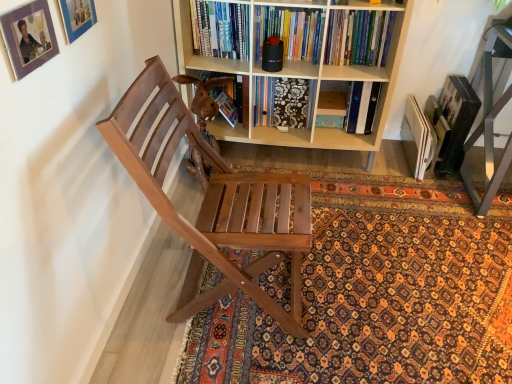
This screenshot has width=512, height=384. Describe the element at coordinates (205, 102) in the screenshot. I see `brown wooden swivel chair at center` at that location.

This screenshot has width=512, height=384. What do you see at coordinates (77, 17) in the screenshot? I see `matte blue picture frame at upper left, the 2th picture frame when ordered from front to back` at bounding box center [77, 17].

What do you see at coordinates (212, 200) in the screenshot?
I see `wooden chair at left` at bounding box center [212, 200].

Identify the location of patterned carpet at center. This screenshot has width=512, height=384. (377, 294).

Could you tell me if brown wooden swivel chair at center is turned towards matte blue picture frame at upper left, the first picture frame when ordered from back to front?

No, brown wooden swivel chair at center is not facing towards matte blue picture frame at upper left, the first picture frame when ordered from back to front.

Between brown wooden swivel chair at center and matte blue picture frame at upper left, the 2th picture frame when ordered from front to back, which one has more height?

With more height is brown wooden swivel chair at center.

How much distance is there between brown wooden swivel chair at center and matte blue picture frame at upper left, the first picture frame when ordered from back to front?

32.03 inches.

Which is in front, brown wooden swivel chair at center or matte blue picture frame at upper left, the first picture frame when ordered from back to front?

matte blue picture frame at upper left, the first picture frame when ordered from back to front.

Consider the image. From a real-world perspective, who is located higher, matte purple picture frame at upper left, marked as the first picture frame in a front-to-back arrangement, or wooden chair at left?

matte purple picture frame at upper left, marked as the first picture frame in a front-to-back arrangement, from a real-world perspective.

What's the angular difference between matte purple picture frame at upper left, marked as the first picture frame in a front-to-back arrangement, and wooden chair at left's facing directions?

They differ by 0.158 degrees in their facing directions.

Is matte purple picture frame at upper left, which is the second picture frame from back to front, wider than wooden chair at left?

No, matte purple picture frame at upper left, which is the second picture frame from back to front, is not wider than wooden chair at left.

Considering the relative sizes of matte purple picture frame at upper left, marked as the first picture frame in a front-to-back arrangement, and wooden chair at left in the image provided, is matte purple picture frame at upper left, marked as the first picture frame in a front-to-back arrangement, bigger than wooden chair at left?

No.

Choose the correct answer: Is patterned carpet at center inside matte purple picture frame at upper left, marked as the first picture frame in a front-to-back arrangement, or outside it?

patterned carpet at center is not inside matte purple picture frame at upper left, marked as the first picture frame in a front-to-back arrangement, it's outside.

Considering the positions of point (200, 370) and point (22, 61), is point (200, 370) closer or farther from the camera than point (22, 61)?

Point (200, 370) appears to be farther away from the viewer than point (22, 61).

Measure the distance between patterned carpet at center and matte purple picture frame at upper left, which is the second picture frame from back to front.

The distance of patterned carpet at center from matte purple picture frame at upper left, which is the second picture frame from back to front, is 4.56 feet.

From a real-world perspective, is patterned carpet at center on matte purple picture frame at upper left, marked as the first picture frame in a front-to-back arrangement?

Incorrect, from a real-world perspective, patterned carpet at center is lower than matte purple picture frame at upper left, marked as the first picture frame in a front-to-back arrangement.

Between brown wooden swivel chair at center and light wood bookcase at center, which one has less height?

brown wooden swivel chair at center.

Can you confirm if brown wooden swivel chair at center is smaller than light wood bookcase at center?

Yes.

Is point (204, 116) farther from camera compared to point (222, 70)?

No, it is in front of (222, 70).

Is hardcover book at upper center thinner than matte purple picture frame at upper left, which is the second picture frame from back to front?

Incorrect, the width of hardcover book at upper center is not less than that of matte purple picture frame at upper left, which is the second picture frame from back to front.

Considering the sizes of hardcover book at upper center and matte purple picture frame at upper left, marked as the first picture frame in a front-to-back arrangement, in the image, is hardcover book at upper center taller or shorter than matte purple picture frame at upper left, marked as the first picture frame in a front-to-back arrangement,?

Considering their sizes, hardcover book at upper center has more height than matte purple picture frame at upper left, marked as the first picture frame in a front-to-back arrangement.

Considering the relative positions of hardcover book at upper center and matte purple picture frame at upper left, which is the second picture frame from back to front, in the image provided, is hardcover book at upper center to the right of matte purple picture frame at upper left, which is the second picture frame from back to front, from the viewer's perspective?

Yes, hardcover book at upper center is to the right of matte purple picture frame at upper left, which is the second picture frame from back to front.

The height and width of the screenshot is (384, 512). What are the coordinates of `book that is on the right side of matte purple picture frame at upper left, marked as the first picture frame in a front-to-back arrangement` in the screenshot? It's located at (359, 37).

Could you tell me if brown wooden swivel chair at center is facing patterned carpet at center?

No, brown wooden swivel chair at center is not facing towards patterned carpet at center.

Considering the relative sizes of brown wooden swivel chair at center and patterned carpet at center in the image provided, is brown wooden swivel chair at center shorter than patterned carpet at center?

In fact, brown wooden swivel chair at center may be taller than patterned carpet at center.

From the image's perspective, which one is positioned lower, brown wooden swivel chair at center or patterned carpet at center?

patterned carpet at center appears lower in the image.

Does brown wooden swivel chair at center contain patterned carpet at center?

Actually, patterned carpet at center is outside brown wooden swivel chair at center.

Can you tell me how much patterned carpet at center and light wood bookcase at center differ in facing direction?

The angular difference between patterned carpet at center and light wood bookcase at center is 0.772 degrees.

Which is more to the left, patterned carpet at center or light wood bookcase at center?

Positioned to the left is light wood bookcase at center.

From a real-world perspective, who is located lower, patterned carpet at center or light wood bookcase at center?

patterned carpet at center.

Is the depth of patterned carpet at center less than that of light wood bookcase at center?

Yes, it is.

Locate an element on the screen. The image size is (512, 384). swivel chair behind the matte blue picture frame at upper left, the 2th picture frame when ordered from front to back is located at coordinates (205, 102).

Identify the location of picture frame lying in front of the wooden chair at left. (29, 37).

Estimate the real-world distances between objects in this image. Which object is closer to brown wooden swivel chair at center, patterned carpet at center or light wood bookcase at center?

Based on the image, light wood bookcase at center appears to be nearer to brown wooden swivel chair at center.

When comparing their distances from matte blue picture frame at upper left, the first picture frame when ordered from back to front, does patterned carpet at center or wooden chair at left seem further?

patterned carpet at center.

In the scene shown: When comparing their distances from wooden chair at left, does hardcover book at upper center or light wood bookcase at center seem closer?

Among the two, light wood bookcase at center is located nearer to wooden chair at left.

When comparing their distances from light wood bookcase at center, does matte purple picture frame at upper left, marked as the first picture frame in a front-to-back arrangement, or wooden chair at left seem further?

Based on the image, matte purple picture frame at upper left, marked as the first picture frame in a front-to-back arrangement, appears to be further to light wood bookcase at center.

Estimate the real-world distances between objects in this image. Which object is closer to matte blue picture frame at upper left, the first picture frame when ordered from back to front, patterned carpet at center or hardcover book at upper center?

hardcover book at upper center is positioned closer to the anchor matte blue picture frame at upper left, the first picture frame when ordered from back to front.

Considering their positions, is hardcover book at upper center positioned closer to brown wooden swivel chair at center than patterned carpet at center?

hardcover book at upper center.

Estimate the real-world distances between objects in this image. Which object is closer to patterned carpet at center, brown wooden swivel chair at center or wooden chair at left?

wooden chair at left lies closer to patterned carpet at center than the other object.

Considering their positions, is brown wooden swivel chair at center positioned closer to hardcover book at upper center than matte blue picture frame at upper left, the first picture frame when ordered from back to front?

The object closer to hardcover book at upper center is brown wooden swivel chair at center.

The width and height of the screenshot is (512, 384). What are the coordinates of `swivel chair located between matte purple picture frame at upper left, marked as the first picture frame in a front-to-back arrangement, and hardcover book at upper center in the depth direction` in the screenshot? It's located at (205, 102).

The height and width of the screenshot is (384, 512). What are the coordinates of `bookcase located between matte purple picture frame at upper left, which is the second picture frame from back to front, and hardcover book at upper center in the depth direction` in the screenshot? It's located at (300, 75).

The height and width of the screenshot is (384, 512). In order to click on chair between matte blue picture frame at upper left, the first picture frame when ordered from back to front, and patterned carpet at center, in the horizontal direction in this screenshot , I will do 212,200.

The height and width of the screenshot is (384, 512). Identify the location of swivel chair between wooden chair at left and hardcover book at upper center along the z-axis. (205, 102).